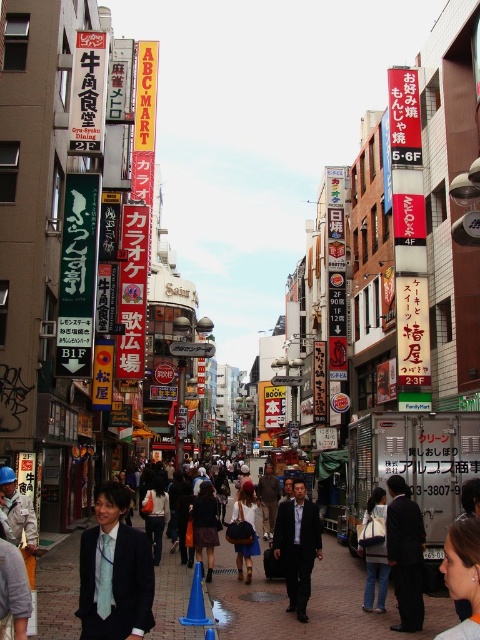
Question: Estimate the real-world distances between objects in this image. Which object is closer to the dark suit at center?

Choices:
 (A) matte black suit at center
 (B) denim jacket at center
 (C) white plastic sign at center
 (D) light blue tie at center

Answer: (B)

Question: Can you confirm if red fabric bag at center is bigger than white plastic sign at center?

Choices:
 (A) yes
 (B) no

Answer: (B)

Question: Which of the following is the farthest from the observer?

Choices:
 (A) brick pavement at center
 (B) dark brown leather skirt at center
 (C) white plastic sign at center

Answer: (C)

Question: Is matte black suit at center smaller than white plastic sign at center?

Choices:
 (A) no
 (B) yes

Answer: (B)

Question: Is blonde hair at center positioned at the back of white plastic sign at center?

Choices:
 (A) yes
 (B) no

Answer: (B)

Question: Among these points, which one is nearest to the camera?

Choices:
 (A) (264, 580)
 (B) (231, 531)

Answer: (A)